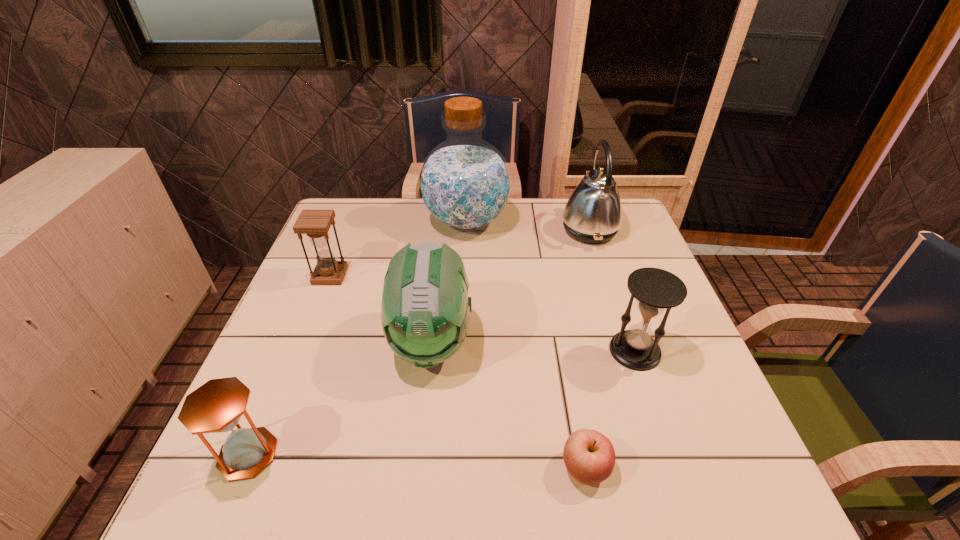
Where is `blank space at the far right corner of the desktop`? This screenshot has width=960, height=540. blank space at the far right corner of the desktop is located at coordinates (631, 230).

The height and width of the screenshot is (540, 960). I want to click on vacant space at the near right corner, so click(x=736, y=471).

Locate an element on the screen. The width and height of the screenshot is (960, 540). vacant point located between the second farthest hourglass and the nearest hourglass is located at coordinates (442, 402).

The height and width of the screenshot is (540, 960). In order to click on vacant area that lies between the football helmet and the nearest hourglass in this screenshot , I will do `click(340, 398)`.

Identify the location of free space between the football helmet and the second farthest hourglass. (533, 346).

The image size is (960, 540). I want to click on vacant area that lies between the kettle and the tallest object, so click(x=528, y=225).

You are a GUI agent. You are given a task and a screenshot of the screen. Output one action in this format:
    pyautogui.click(x=<x>, y=<y>)
    Task: Click on the vacant area that lies between the third tallest object and the nearest hourglass
    The height and width of the screenshot is (540, 960).
    Given the screenshot: What is the action you would take?
    pyautogui.click(x=340, y=398)

Locate an element on the screen. empty location between the third farthest object and the fifth shortest object is located at coordinates (380, 309).

The width and height of the screenshot is (960, 540). Identify the location of vacant point located between the rightmost hourglass and the football helmet. (533, 346).

Image resolution: width=960 pixels, height=540 pixels. Find the location of `blank region between the apple and the second nearest hourglass`. blank region between the apple and the second nearest hourglass is located at coordinates (611, 409).